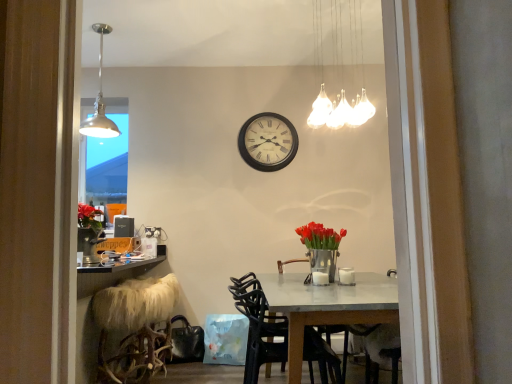
Question: Is metallic vase with red tulips at center next to fuzzy white stool at lower left and touching it?

Choices:
 (A) no
 (B) yes

Answer: (A)

Question: Is fuzzy white stool at lower left surrounded by metallic vase with red tulips at center?

Choices:
 (A) yes
 (B) no

Answer: (B)

Question: Can you confirm if metallic vase with red tulips at center is smaller than fuzzy white stool at lower left?

Choices:
 (A) yes
 (B) no

Answer: (A)

Question: From a real-world perspective, does metallic vase with red tulips at center sit lower than fuzzy white stool at lower left?

Choices:
 (A) no
 (B) yes

Answer: (A)

Question: From the image's perspective, is metallic vase with red tulips at center above fuzzy white stool at lower left?

Choices:
 (A) no
 (B) yes

Answer: (B)

Question: Is metallic vase with red tulips at center bigger or smaller than wooden wall clock at center?

Choices:
 (A) big
 (B) small

Answer: (A)

Question: From the image's perspective, is metallic vase with red tulips at center above or below wooden wall clock at center?

Choices:
 (A) above
 (B) below

Answer: (B)

Question: Considering the positions of metallic vase with red tulips at center and wooden wall clock at center in the image, is metallic vase with red tulips at center wider or thinner than wooden wall clock at center?

Choices:
 (A) wide
 (B) thin

Answer: (A)

Question: Does point click(327, 238) appear closer or farther from the camera than point click(262, 120)?

Choices:
 (A) farther
 (B) closer

Answer: (B)

Question: Is point (121, 304) positioned closer to the camera than point (101, 54)?

Choices:
 (A) farther
 (B) closer

Answer: (B)

Question: Considering the positions of fuzzy white stool at lower left and metallic pendant light at upper left, the first lamp from the left, in the image, is fuzzy white stool at lower left bigger or smaller than metallic pendant light at upper left, the first lamp from the left,?

Choices:
 (A) small
 (B) big

Answer: (B)

Question: Which is correct: fuzzy white stool at lower left is inside metallic pendant light at upper left, the first lamp when ordered from back to front, or outside of it?

Choices:
 (A) outside
 (B) inside

Answer: (A)

Question: From the image's perspective, is fuzzy white stool at lower left located above or below metallic pendant light at upper left, marked as the 2th lamp in a front-to-back arrangement?

Choices:
 (A) below
 (B) above

Answer: (A)

Question: From the image's perspective, is white glass chandelier at upper center, placed as the 1th lamp when sorted from right to left, positioned above or below metallic vase with red tulips at center?

Choices:
 (A) below
 (B) above

Answer: (B)

Question: In the image, is white glass chandelier at upper center, acting as the 1th lamp starting from the front, positioned in front of or behind metallic vase with red tulips at center?

Choices:
 (A) front
 (B) behind

Answer: (A)